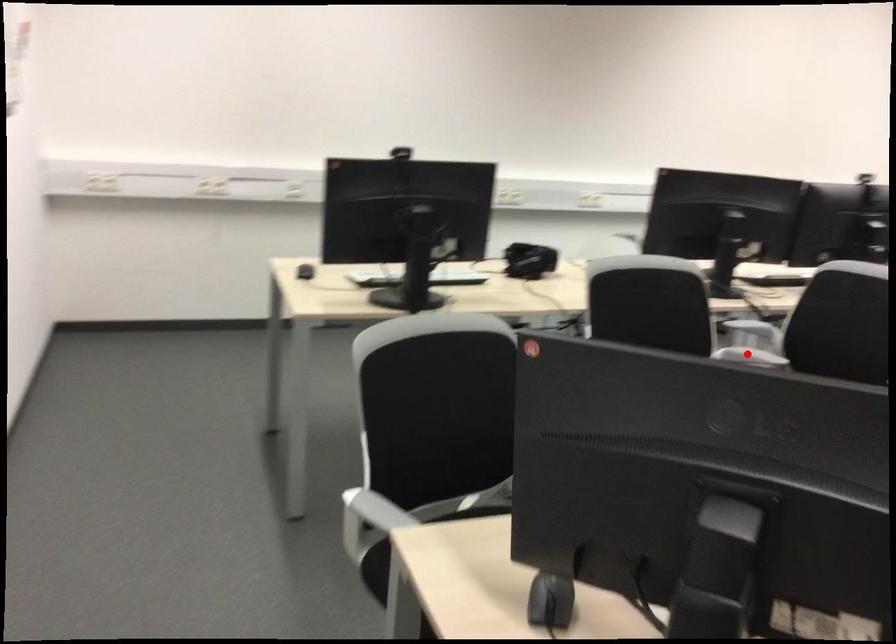
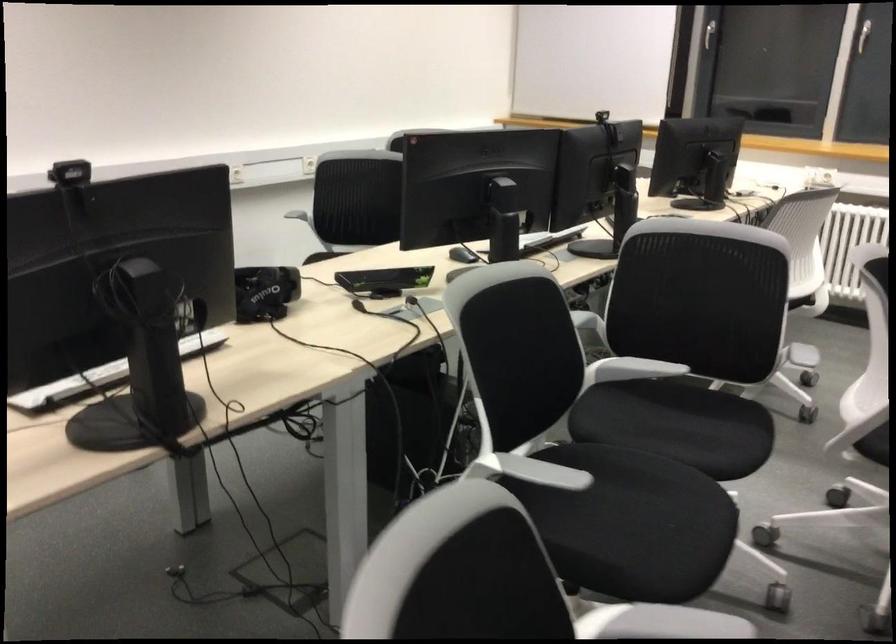
Question: I am providing you with two images of the same scene from different viewpoints. In image1, a red point is highlighted. Considering the same 3D point in image2, which of the following is correct?

Choices:
 (A) It is closer
 (B) It is farther

Answer: (A)